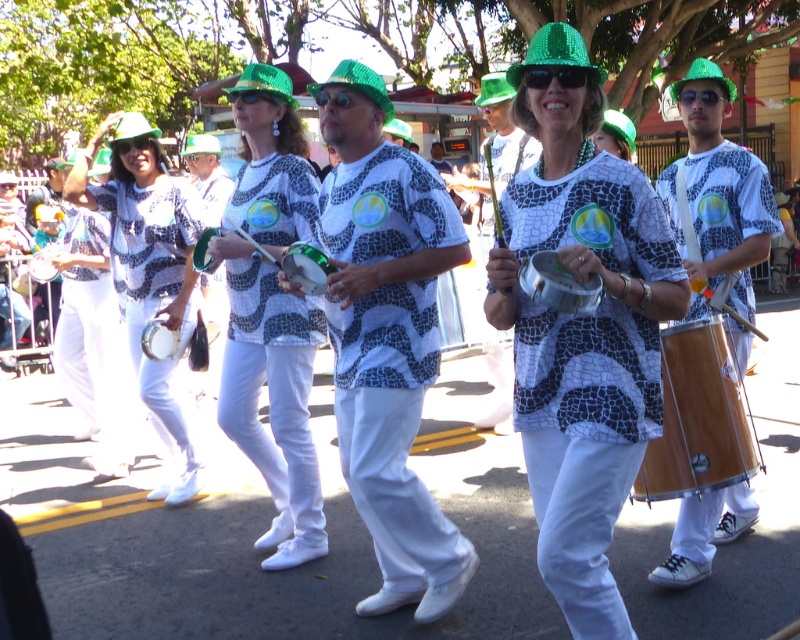
You are a photographer standing at the edge of the parade route. You want to take a photo that includes both the wooden drum at center and the matte green hat at center. The camera you are using has a maximum focus range of 2.5 meters. Will both objects be in focus?

The wooden drum at center is 2.55 meters away from matte green hat at center. Since the distance between them exceeds the camera maximum focus range of 2.5 meters, the camera cannot focus on both objects simultaneously.

You are organizing a parade and need to place the matte black drum at center and the wooden drum at center on a cart. The cart can only hold one drum due to space constraints. Which drum should you choose if you want the one that takes up more space?

The matte black drum at center is larger in size compared to the wooden drum at center, so you should choose the matte black drum at center because it takes up more space.

You are a photographer standing at the front of the parade. You want to take a photo that includes both the matte black drum at center and the wooden drum at center. Based on their positions, which drum should you focus on first to ensure both are in the frame?

The matte black drum at center is below the wooden drum at center, so you should focus on the wooden drum at center first to ensure both are in the frame.